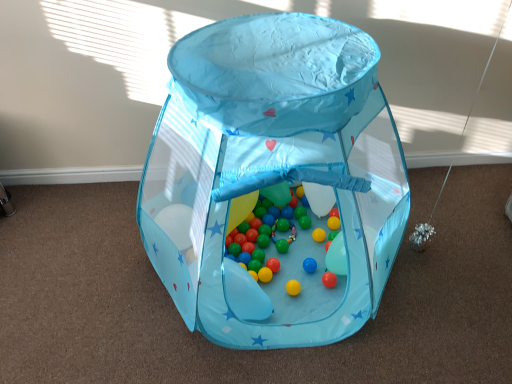
Consider the image. Measure the distance between transparent fabric play tent at center, which ranks as the second toy in bottom-to-top order, and camera.

A distance of 1.08 meters exists between transparent fabric play tent at center, which ranks as the second toy in bottom-to-top order, and camera.

Image resolution: width=512 pixels, height=384 pixels. Describe the element at coordinates (241, 209) in the screenshot. I see `translucent plastic balloon at center` at that location.

The height and width of the screenshot is (384, 512). Identify the location of transparent fabric play tent at center, which is the 1th toy in top-to-bottom order. (273, 175).

From a real-world perspective, is transparent fabric play tent at center, which ranks as the second toy in bottom-to-top order, positioned above or below translucent plastic balloon at center?

transparent fabric play tent at center, which ranks as the second toy in bottom-to-top order, is above translucent plastic balloon at center.

Locate an element on the screen. The image size is (512, 384). toy above the translucent plastic balloon at center (from a real-world perspective) is located at coordinates (273, 175).

Is transparent fabric play tent at center, which ranks as the second toy in bottom-to-top order, oriented away from translucent plastic balloon at center?

That's right, transparent fabric play tent at center, which ranks as the second toy in bottom-to-top order, is facing away from translucent plastic balloon at center.

Between transparent fabric play tent at center, which is the 1th toy in top-to-bottom order, and translucent plastic balloon at center, which one is positioned behind?

translucent plastic balloon at center is more distant.

Is point (250, 207) behind point (332, 145)?

Yes, it is.

Does translucent plastic balloon at center have a lesser width compared to transparent fabric play tent at center, which ranks as the second toy in bottom-to-top order?

Correct, the width of translucent plastic balloon at center is less than that of transparent fabric play tent at center, which ranks as the second toy in bottom-to-top order.

From a real-world perspective, who is located higher, translucent plastic balloon at center or transparent fabric play tent at center, which is the 1th toy in top-to-bottom order?

transparent fabric play tent at center, which is the 1th toy in top-to-bottom order, from a real-world perspective.

Is transparent fabric play tent at center, which is the 1th toy in top-to-bottom order, thinner than multicolored glossy balls at center, positioned as the 2th toy in top-to-bottom order?

Incorrect, the width of transparent fabric play tent at center, which is the 1th toy in top-to-bottom order, is not less than that of multicolored glossy balls at center, positioned as the 2th toy in top-to-bottom order.

Does point (243, 135) lie in front of point (269, 195)?

Yes, it is.

Is multicolored glossy balls at center, positioned as the 2th toy in top-to-bottom order, a part of transparent fabric play tent at center, which ranks as the second toy in bottom-to-top order?

Yes, transparent fabric play tent at center, which ranks as the second toy in bottom-to-top order, contains multicolored glossy balls at center, positioned as the 2th toy in top-to-bottom order.

Who is shorter, transparent fabric play tent at center, which is the 1th toy in top-to-bottom order, or multicolored glossy balls at center, positioned as the 2th toy in top-to-bottom order?

multicolored glossy balls at center, positioned as the 2th toy in top-to-bottom order, is shorter.

Between translucent plastic balloon at center and multicolored glossy balls at center, which ranks as the first toy in bottom-to-top order, which one is positioned in front?

multicolored glossy balls at center, which ranks as the first toy in bottom-to-top order.

Consider the image. Is translucent plastic balloon at center positioned with its back to multicolored glossy balls at center, positioned as the 2th toy in top-to-bottom order?

No, translucent plastic balloon at center is not facing away from multicolored glossy balls at center, positioned as the 2th toy in top-to-bottom order.

From a real-world perspective, is translucent plastic balloon at center positioned above or below multicolored glossy balls at center, which ranks as the first toy in bottom-to-top order?

translucent plastic balloon at center is situated higher than multicolored glossy balls at center, which ranks as the first toy in bottom-to-top order, in the real world.

Consider the image. Considering their positions, is multicolored glossy balls at center, which ranks as the first toy in bottom-to-top order, located in front of or behind translucent plastic balloon at center?

Visually, multicolored glossy balls at center, which ranks as the first toy in bottom-to-top order, is located in front of translucent plastic balloon at center.

What's the angular difference between multicolored glossy balls at center, which ranks as the first toy in bottom-to-top order, and translucent plastic balloon at center's facing directions?

The angular difference between multicolored glossy balls at center, which ranks as the first toy in bottom-to-top order, and translucent plastic balloon at center is 15.6 degrees.

Is multicolored glossy balls at center, which ranks as the first toy in bottom-to-top order, looking in the opposite direction of translucent plastic balloon at center?

No, multicolored glossy balls at center, which ranks as the first toy in bottom-to-top order,'s orientation is not away from translucent plastic balloon at center.

What's the angular difference between multicolored glossy balls at center, which ranks as the first toy in bottom-to-top order, and transparent fabric play tent at center, which is the 1th toy in top-to-bottom order,'s facing directions?

15.6 degrees separate the facing orientations of multicolored glossy balls at center, which ranks as the first toy in bottom-to-top order, and transparent fabric play tent at center, which is the 1th toy in top-to-bottom order.

From the image's perspective, is multicolored glossy balls at center, positioned as the 2th toy in top-to-bottom order, on transparent fabric play tent at center, which ranks as the second toy in bottom-to-top order?

Actually, multicolored glossy balls at center, positioned as the 2th toy in top-to-bottom order, appears below transparent fabric play tent at center, which ranks as the second toy in bottom-to-top order, in the image.

Can you confirm if multicolored glossy balls at center, positioned as the 2th toy in top-to-bottom order, is thinner than transparent fabric play tent at center, which ranks as the second toy in bottom-to-top order?

Indeed, multicolored glossy balls at center, positioned as the 2th toy in top-to-bottom order, has a lesser width compared to transparent fabric play tent at center, which ranks as the second toy in bottom-to-top order.

Would you say multicolored glossy balls at center, positioned as the 2th toy in top-to-bottom order, is outside transparent fabric play tent at center, which is the 1th toy in top-to-bottom order?

No, multicolored glossy balls at center, positioned as the 2th toy in top-to-bottom order, is inside or overlapping with transparent fabric play tent at center, which is the 1th toy in top-to-bottom order.

Find the location of a particular element. The height and width of the screenshot is (384, 512). balloon lying on the left of transparent fabric play tent at center, which is the 1th toy in top-to-bottom order is located at coordinates (241, 209).

Where is `toy above the translucent plastic balloon at center (from a real-world perspective)`? Image resolution: width=512 pixels, height=384 pixels. toy above the translucent plastic balloon at center (from a real-world perspective) is located at coordinates (273, 175).

Which object lies nearer to the anchor point multicolored glossy balls at center, which ranks as the first toy in bottom-to-top order, translucent plastic balloon at center or transparent fabric play tent at center, which ranks as the second toy in bottom-to-top order?

translucent plastic balloon at center is closer to multicolored glossy balls at center, which ranks as the first toy in bottom-to-top order.

From the image, which object appears to be farther from translucent plastic balloon at center, transparent fabric play tent at center, which is the 1th toy in top-to-bottom order, or multicolored glossy balls at center, positioned as the 2th toy in top-to-bottom order?

Based on the image, transparent fabric play tent at center, which is the 1th toy in top-to-bottom order, appears to be further to translucent plastic balloon at center.

From the image, which object appears to be farther from transparent fabric play tent at center, which is the 1th toy in top-to-bottom order, translucent plastic balloon at center or multicolored glossy balls at center, which ranks as the first toy in bottom-to-top order?

translucent plastic balloon at center is positioned further to the anchor transparent fabric play tent at center, which is the 1th toy in top-to-bottom order.

Looking at the image, which one is located further to translucent plastic balloon at center, multicolored glossy balls at center, positioned as the 2th toy in top-to-bottom order, or transparent fabric play tent at center, which ranks as the second toy in bottom-to-top order?

The object further to translucent plastic balloon at center is transparent fabric play tent at center, which ranks as the second toy in bottom-to-top order.

Considering their positions, is multicolored glossy balls at center, which ranks as the first toy in bottom-to-top order, positioned closer to transparent fabric play tent at center, which is the 1th toy in top-to-bottom order, than translucent plastic balloon at center?

Based on the image, multicolored glossy balls at center, which ranks as the first toy in bottom-to-top order, appears to be nearer to transparent fabric play tent at center, which is the 1th toy in top-to-bottom order.

Based on their spatial positions, is transparent fabric play tent at center, which ranks as the second toy in bottom-to-top order, or translucent plastic balloon at center closer to multicolored glossy balls at center, positioned as the 2th toy in top-to-bottom order?

Among the two, translucent plastic balloon at center is located nearer to multicolored glossy balls at center, positioned as the 2th toy in top-to-bottom order.

Find the location of a particular element. This screenshot has width=512, height=384. toy located between transparent fabric play tent at center, which ranks as the second toy in bottom-to-top order, and translucent plastic balloon at center in the depth direction is located at coordinates [x=269, y=226].